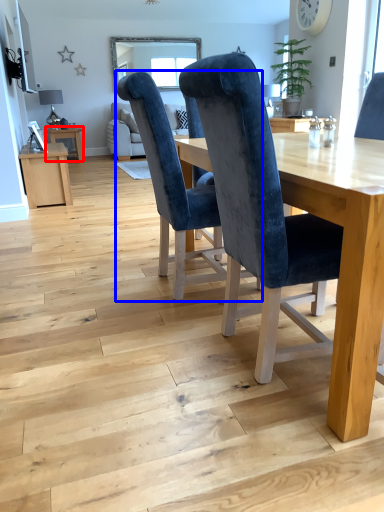
Question: Which of the following is the closest to the observer, table (highlighted by a red box) or chair (highlighted by a blue box)?

Choices:
 (A) table
 (B) chair

Answer: (B)